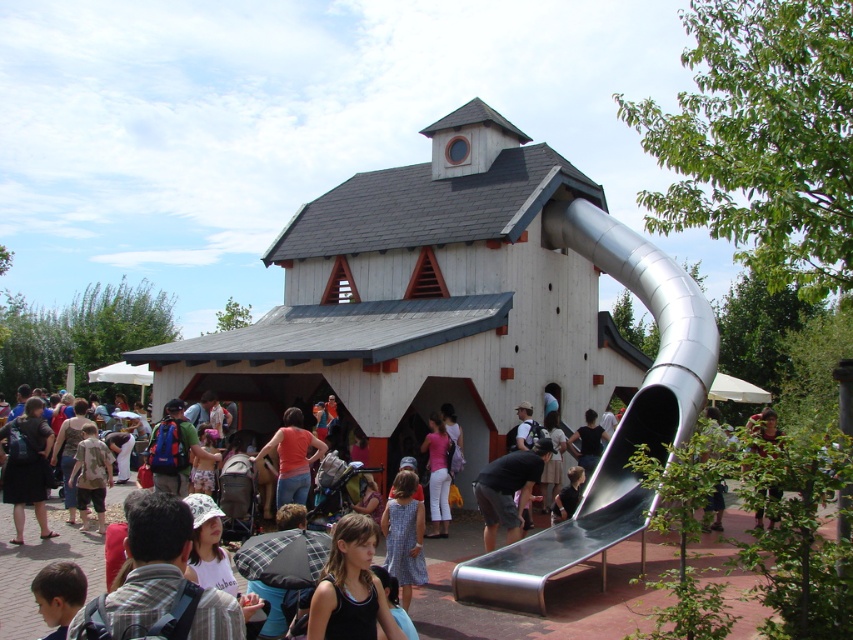
Question: Among these points, which one is farthest from the camera?

Choices:
 (A) (560, 493)
 (B) (523, 465)
 (C) (277, 452)
 (D) (759, 518)

Answer: (D)

Question: Which point is closer to the camera taking this photo?

Choices:
 (A) (300, 440)
 (B) (634, 506)
 (C) (555, 508)

Answer: (B)

Question: Does green leafy tree at lower right appear over matte black shirt at lower center?

Choices:
 (A) yes
 (B) no

Answer: (A)

Question: Does matte orange tank top at center appear on the left side of matte black shirt at lower center?

Choices:
 (A) yes
 (B) no

Answer: (A)

Question: Is metallic smooth slide at right below matte black shirt at lower center?

Choices:
 (A) no
 (B) yes

Answer: (A)

Question: Which object is the closest to the matte black shirt at lower center?

Choices:
 (A) dark gray fabric shirt at center
 (B) green leafy tree at lower right
 (C) metallic smooth slide at right
 (D) matte orange tank top at center

Answer: (A)